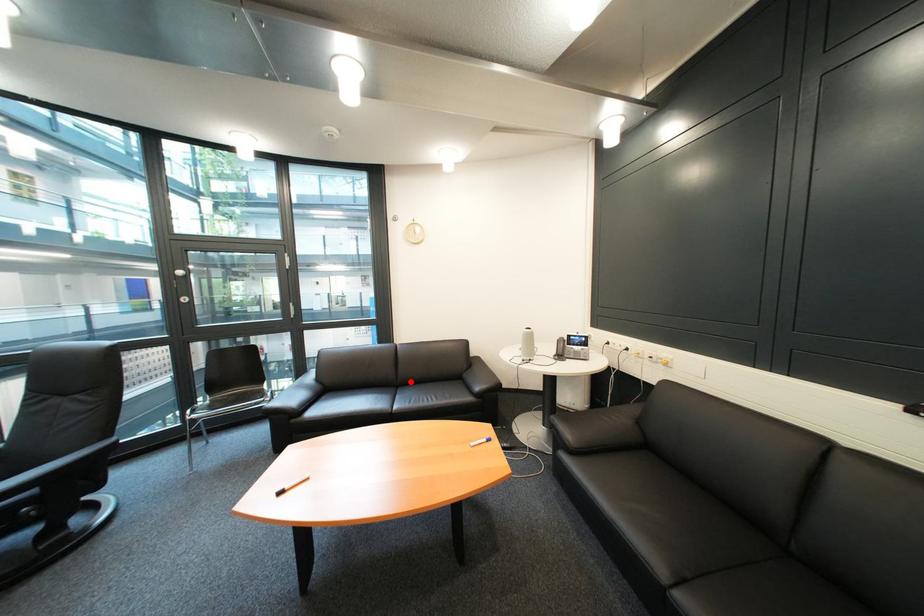
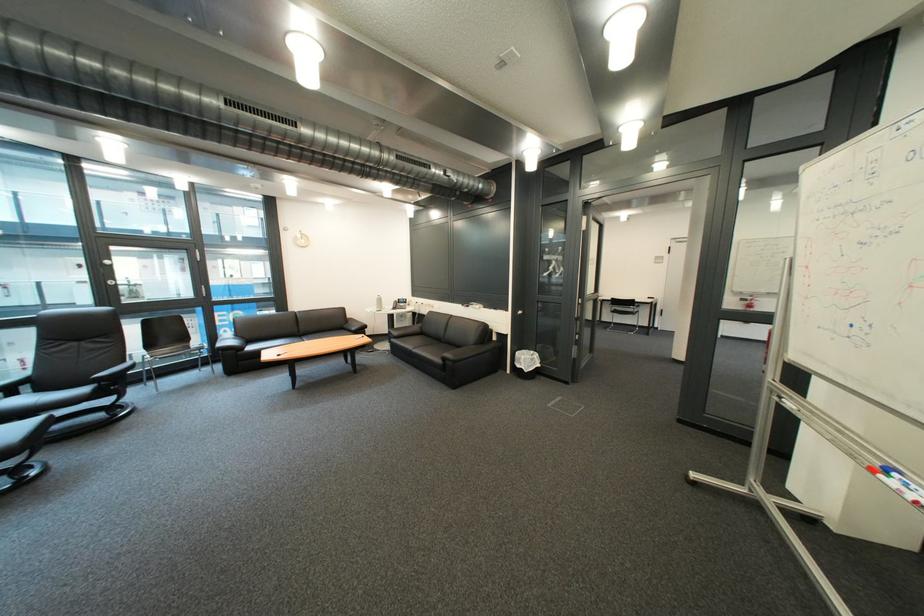
Question: A red point is marked in image1. In image2, is the corresponding 3D point closer to the camera or farther? Reply with the corresponding letter.

Choices:
 (A) The corresponding 3D point is closer.
 (B) The corresponding 3D point is farther.

Answer: (B)